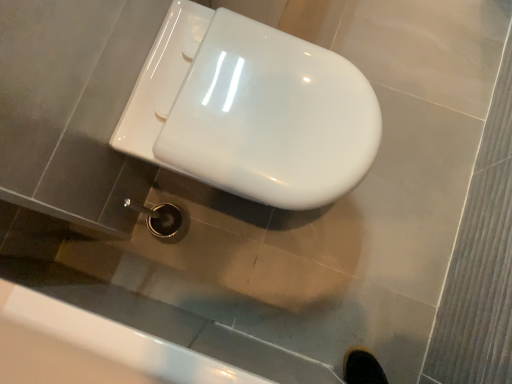
Find the location of a particular element. The width and height of the screenshot is (512, 384). white glossy toilet at center is located at coordinates (251, 110).

What do you see at coordinates (251, 110) in the screenshot? The width and height of the screenshot is (512, 384). I see `white glossy toilet at center` at bounding box center [251, 110].

Consider the image. What is the approximate height of white glossy toilet at center?

white glossy toilet at center is 46.58 centimeters tall.

At what (x,y) coordinates should I click in order to perform the action: click on white glossy toilet at center. Please return your answer as a coordinate pair (x, y). This screenshot has height=384, width=512. Looking at the image, I should click on (251, 110).